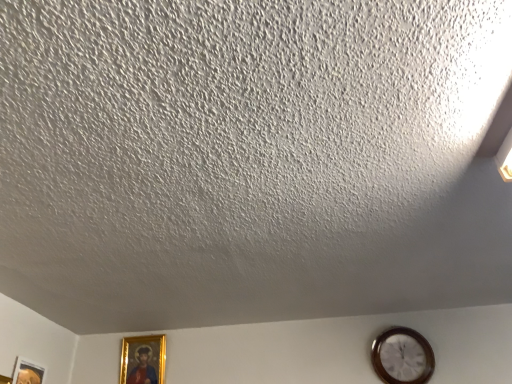
Question: Is wooden wall clock at lower right inside the boundaries of matte gold picture frame at lower left, the 1th picture frame in the left-to-right sequence, or outside?

Choices:
 (A) outside
 (B) inside

Answer: (A)

Question: Is wooden wall clock at lower right bigger or smaller than matte gold picture frame at lower left, the second picture frame when ordered from right to left?

Choices:
 (A) small
 (B) big

Answer: (B)

Question: Estimate the real-world distances between objects in this image. Which object is closer to the wooden wall clock at lower right?

Choices:
 (A) matte gold picture frame at lower left, which is the 1th picture frame in front-to-back order
 (B) gold-framed picture at lower left, which appears as the 2th picture frame when viewed from the left

Answer: (B)

Question: Which of these objects is positioned closest to the gold-framed picture at lower left, which is the 2th picture frame in front-to-back order?

Choices:
 (A) wooden wall clock at lower right
 (B) matte gold picture frame at lower left, the second picture frame when ordered from right to left

Answer: (B)